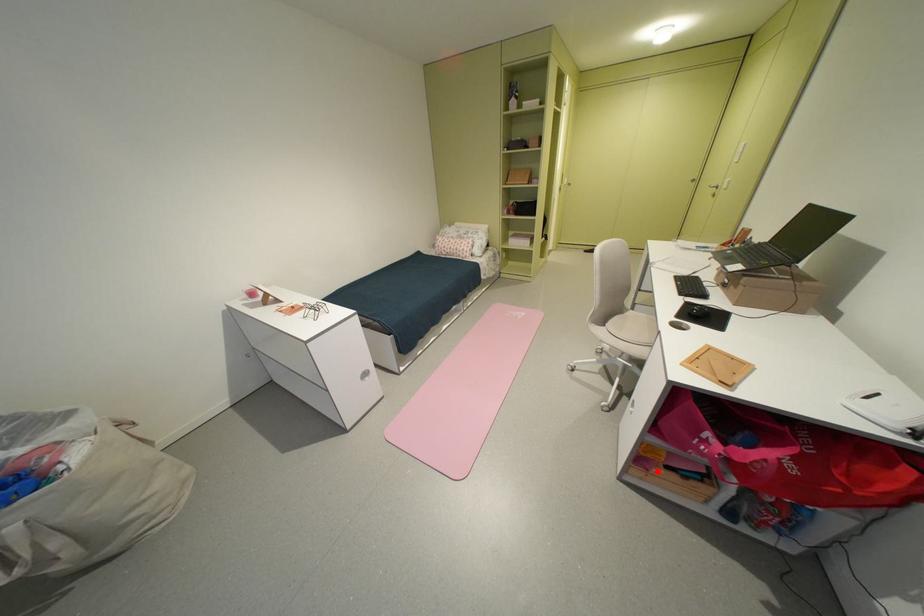
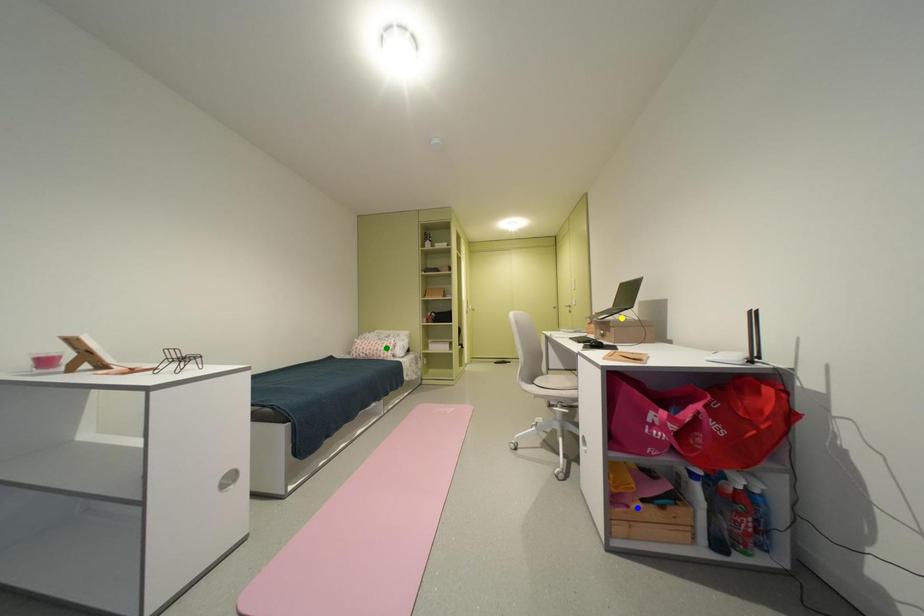
Question: I am providing you with two images of the same scene from different viewpoints. A red point is marked on the first image. You are given multiple points on the second image. Can you choose the point in image 2 that corresponds to the point in image 1?

Choices:
 (A) blue point
 (B) yellow point
 (C) green point

Answer: (A)